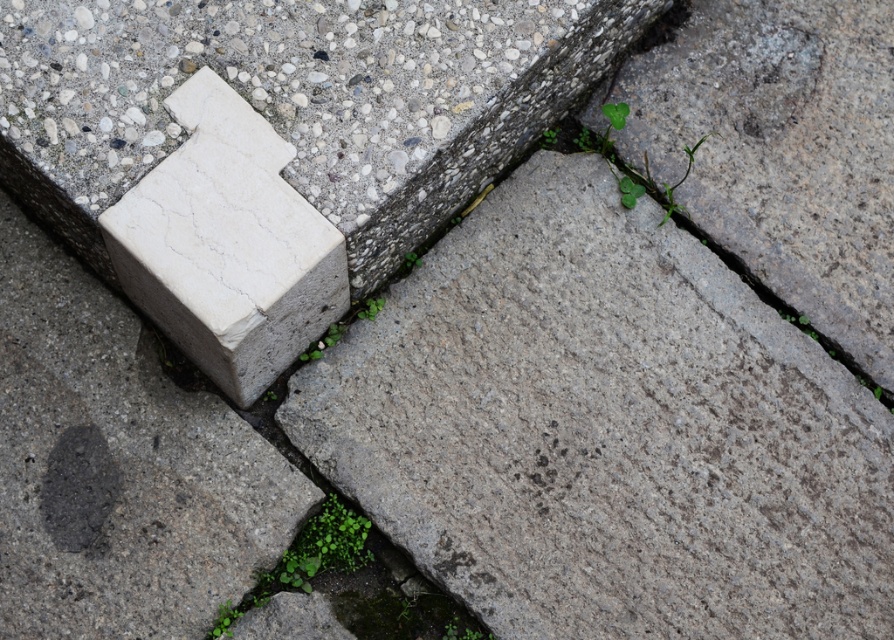
Question: Is white marble block at upper left bigger than green leafy weed at center?

Choices:
 (A) no
 (B) yes

Answer: (B)

Question: Is white marble block at upper left below green leafy weed at lower center?

Choices:
 (A) yes
 (B) no

Answer: (B)

Question: Among these points, which one is nearest to the camera?

Choices:
 (A) (268, 620)
 (B) (230, 225)
 (C) (374, 300)

Answer: (B)

Question: Among these points, which one is farthest from the camera?

Choices:
 (A) (262, 140)
 (B) (367, 310)
 (C) (327, 541)

Answer: (B)

Question: Can you confirm if white marble block at upper left is positioned below green leafy weed at lower center?

Choices:
 (A) yes
 (B) no

Answer: (B)

Question: Which point is closer to the camera?

Choices:
 (A) green leafy weed at center
 (B) green leafy weed at lower center
 (C) white marble block at upper left

Answer: (C)